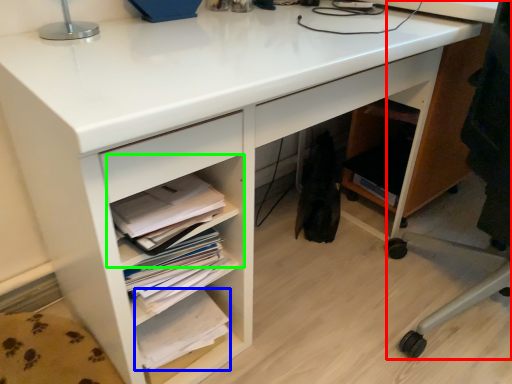
Question: Which object is the closest to the computer chair (highlighted by a red box)? Choose among these: book (highlighted by a blue box) or shelf (highlighted by a green box).

Choices:
 (A) book
 (B) shelf

Answer: (B)